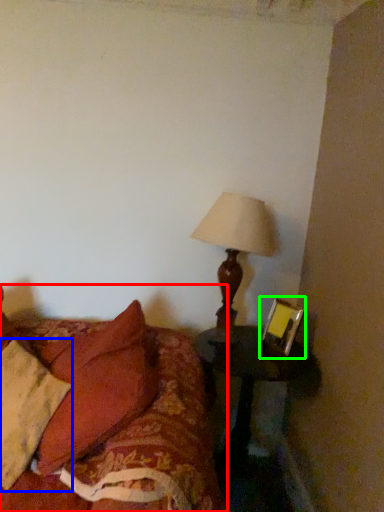
Question: Which object is positioned closest to furniture (highlighted by a red box)? Select from pillow (highlighted by a blue box) and picture frame (highlighted by a green box).

Choices:
 (A) pillow
 (B) picture frame

Answer: (A)